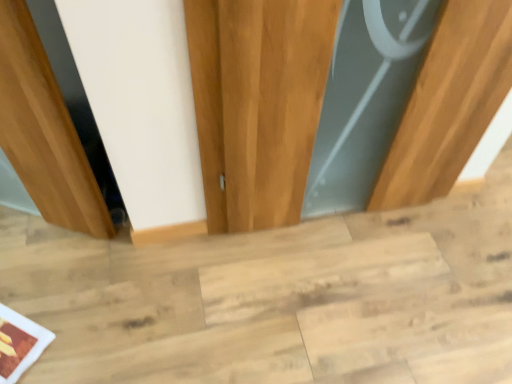
I want to click on vacant region in front of wooden door at center, so click(x=340, y=296).